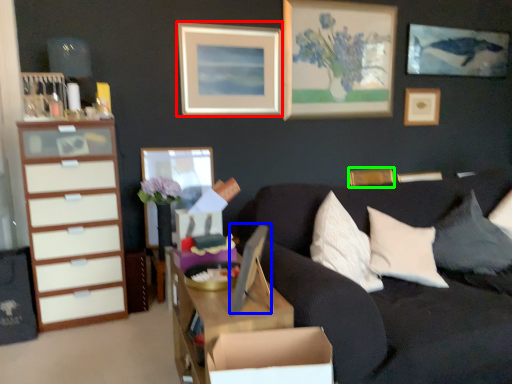
Question: Which object is positioned closest to picture frame (highlighted by a red box)? Select from picture frame (highlighted by a blue box) and picture frame (highlighted by a green box).

Choices:
 (A) picture frame
 (B) picture frame

Answer: (B)